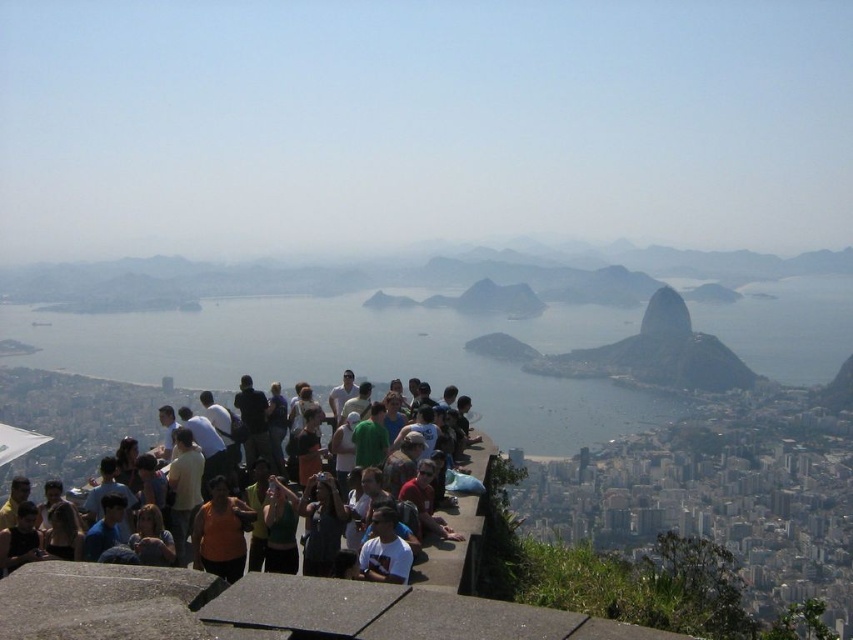
You are standing on the concrete platform with the tourists and want to take a photo that includes both the point at coordinates point (80, 413) and the point at coordinates point (167, 556). Which point should you focus on first to ensure both are in the frame?

You should focus on point (80, 413) first because it is closer to you than point (167, 556), so adjusting the camera to include both points would require framing from the closer point outward.

You are a photographer standing at the edge of the concrete platform. You notice the multicolored casual clothing at center and the denim jacket at lower left in your viewfinder. Which of these two items is taller in the frame?

The multicolored casual clothing at center is taller than the denim jacket at lower left.

You are a photographer trying to capture a clear shot of the orange fabric shirt at center and the matte black camera at center. Since you want to focus on the smaller object, which one should you adjust your camera settings for?

The matte black camera at center is smaller than the orange fabric shirt at center. To focus on the smaller object, adjust your camera settings for the matte black camera at center.